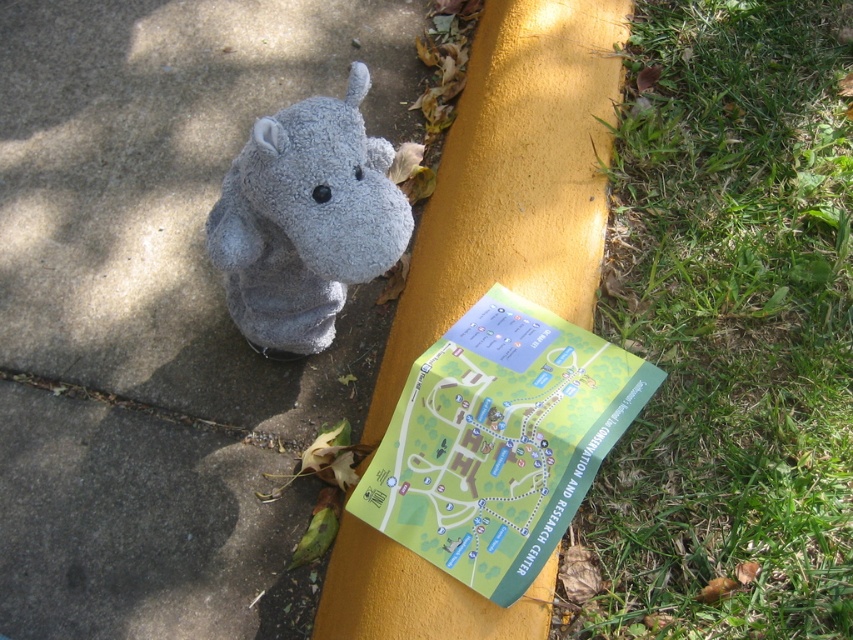
Question: Which object is the closest to the soft gray plush hippo at center?

Choices:
 (A) green grass at lower right
 (B) gray fabric hippo at center

Answer: (B)

Question: Estimate the real-world distances between objects in this image. Which object is farther from the yellow painted curb at upper center?

Choices:
 (A) green paper map at center
 (B) soft gray plush hippo at center
 (C) gray fabric hippo at center
 (D) green grass at lower right

Answer: (C)

Question: Does green paper map at center have a smaller size compared to soft gray plush hippo at center?

Choices:
 (A) yes
 (B) no

Answer: (A)

Question: Does green paper map at center have a greater width compared to soft gray plush hippo at center?

Choices:
 (A) no
 (B) yes

Answer: (B)

Question: Among these objects, which one is farthest from the camera?

Choices:
 (A) yellow painted curb at upper center
 (B) green grass at lower right

Answer: (B)

Question: Can you confirm if green paper map at center is thinner than soft gray plush hippo at center?

Choices:
 (A) yes
 (B) no

Answer: (B)